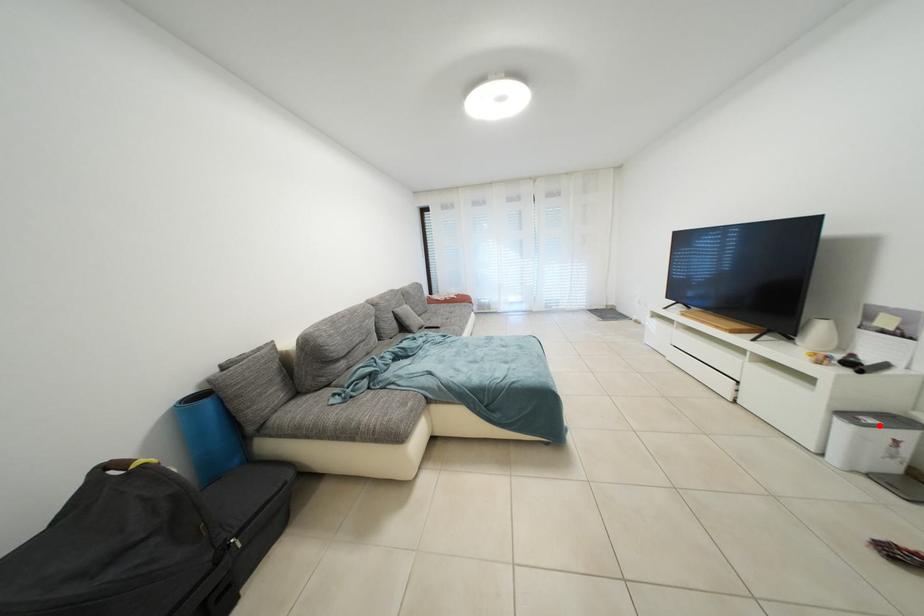
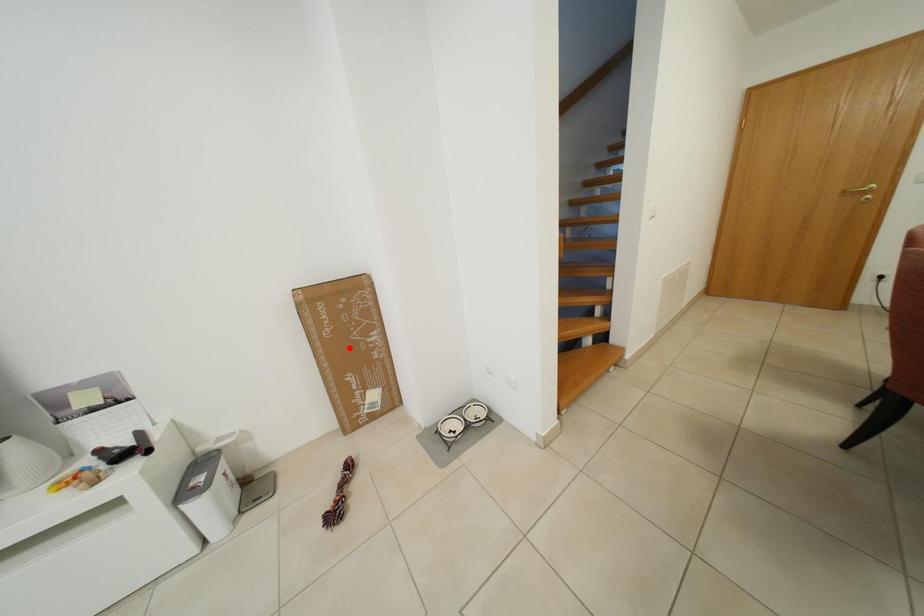
I am providing you with two images of the same scene from different viewpoints. A red point is marked on the first image and another point is marked on the second image. Is the red point in image1 aligned with the point shown in image2?

No